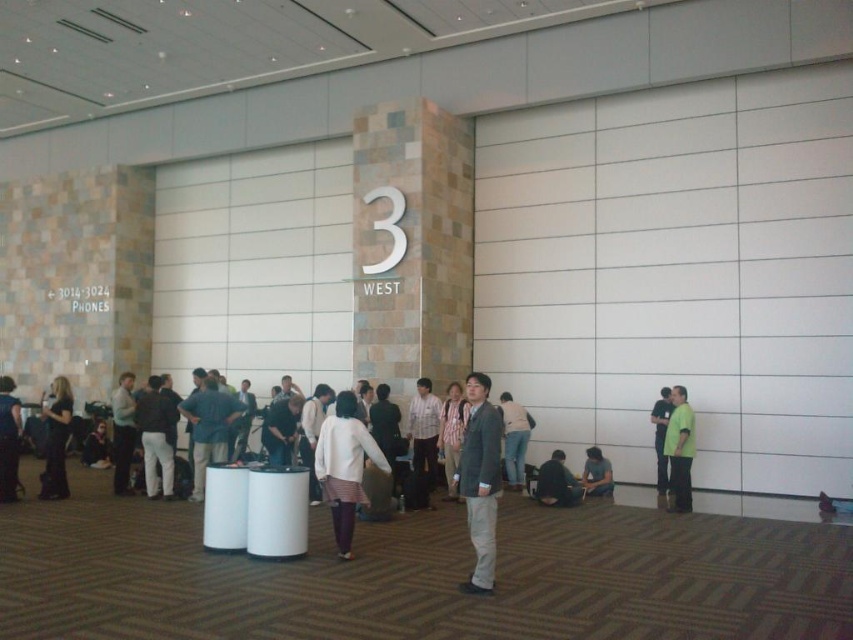
Question: Can you confirm if dark gray fabric jacket at lower center is thinner than matte black jacket at lower left?

Choices:
 (A) yes
 (B) no

Answer: (A)

Question: Can you confirm if white textured sweater at center is wider than green fabric shirt at lower right?

Choices:
 (A) no
 (B) yes

Answer: (B)

Question: Which point is farther to the camera?

Choices:
 (A) dark blue dress at lower left
 (B) white textured sweater at center
 (C) matte black jacket at lower left
 (D) light gray shirt at center

Answer: (C)

Question: Which object is positioned farthest from the black fabric dress at left?

Choices:
 (A) dark gray fabric jacket at lower center
 (B) green fabric shirt at lower right

Answer: (B)

Question: Is dark blue dress at lower left further to the viewer compared to matte black jacket at lower left?

Choices:
 (A) yes
 (B) no

Answer: (B)

Question: Which point appears closest to the camera in this image?

Choices:
 (A) (9, 452)
 (B) (496, 506)
 (C) (595, 490)

Answer: (B)